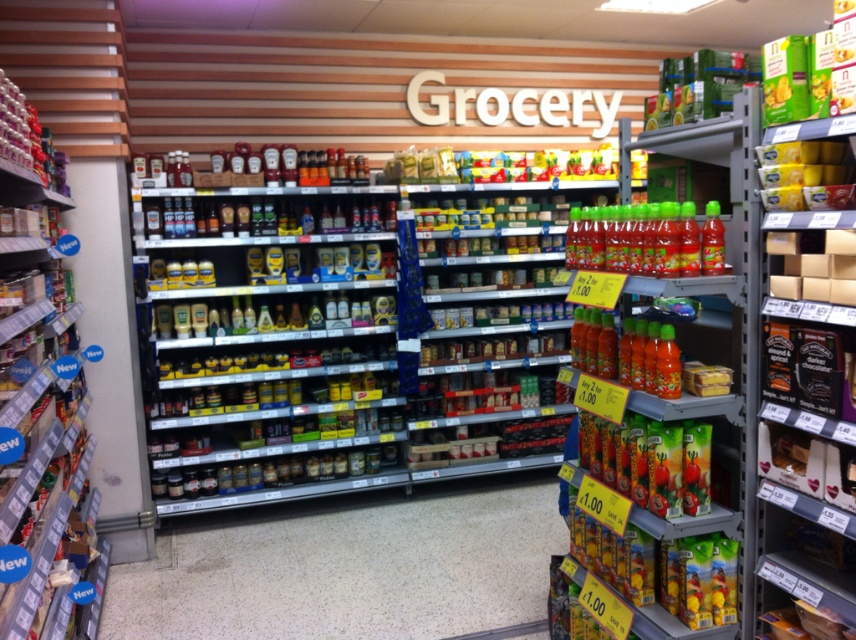
Does point (33, 445) come behind point (706, 435)?

Yes, point (33, 445) is behind point (706, 435).

Can you confirm if metallic silver canisters at left is positioned to the right of green plastic juice at lower right?

No, metallic silver canisters at left is not to the right of green plastic juice at lower right.

Is point (10, 620) farther from viewer compared to point (678, 454)?

No, (10, 620) is closer to viewer.

At what (x,y) coordinates should I click in order to perform the action: click on metallic silver canisters at left. Please return your answer as a coordinate pair (x, y). Image resolution: width=856 pixels, height=640 pixels. Looking at the image, I should click on [39, 384].

Is metallic silver canisters at center positioned at the back of yellow plastic container at upper right?

Yes, metallic silver canisters at center is behind yellow plastic container at upper right.

Between metallic silver canisters at center and yellow plastic container at upper right, which one is positioned lower?

Positioned lower is metallic silver canisters at center.

The image size is (856, 640). What do you see at coordinates (348, 564) in the screenshot? I see `metallic silver canisters at center` at bounding box center [348, 564].

Locate an element on the screen. The image size is (856, 640). metallic silver canisters at center is located at coordinates (348, 564).

Is metallic silver canisters at center bigger than green matte juice bottles at right?

Correct, metallic silver canisters at center is larger in size than green matte juice bottles at right.

What do you see at coordinates (348, 564) in the screenshot? The height and width of the screenshot is (640, 856). I see `metallic silver canisters at center` at bounding box center [348, 564].

This screenshot has height=640, width=856. I want to click on metallic silver canisters at center, so point(348,564).